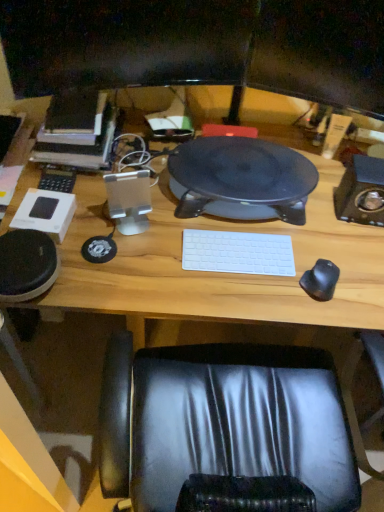
Question: Is matte black monitor at upper center, marked as the 2th computer monitor in a left-to-right arrangement, outside of black rubber mouse at right?

Choices:
 (A) no
 (B) yes

Answer: (B)

Question: Does matte black monitor at upper center, which ranks as the first computer monitor in right-to-left order, have a larger size compared to black rubber mouse at right?

Choices:
 (A) yes
 (B) no

Answer: (A)

Question: Is matte black monitor at upper center, which ranks as the first computer monitor in right-to-left order, at the right side of black rubber mouse at right?

Choices:
 (A) no
 (B) yes

Answer: (B)

Question: From a real-world perspective, is matte black monitor at upper center, marked as the 2th computer monitor in a left-to-right arrangement, located higher than black rubber mouse at right?

Choices:
 (A) no
 (B) yes

Answer: (B)

Question: Is the position of matte black monitor at upper center, which ranks as the first computer monitor in right-to-left order, more distant than that of black rubber mouse at right?

Choices:
 (A) no
 (B) yes

Answer: (A)

Question: Is hardcover book at left facing away from matte black monitor at upper center, which ranks as the first computer monitor in right-to-left order?

Choices:
 (A) yes
 (B) no

Answer: (B)

Question: Considering the relative sizes of hardcover book at left and matte black monitor at upper center, which ranks as the first computer monitor in right-to-left order, in the image provided, is hardcover book at left wider than matte black monitor at upper center, which ranks as the first computer monitor in right-to-left order,?

Choices:
 (A) no
 (B) yes

Answer: (B)

Question: Is hardcover book at left taller than matte black monitor at upper center, which ranks as the first computer monitor in right-to-left order?

Choices:
 (A) yes
 (B) no

Answer: (B)

Question: Does hardcover book at left appear on the right side of matte black monitor at upper center, marked as the 2th computer monitor in a left-to-right arrangement?

Choices:
 (A) no
 (B) yes

Answer: (A)

Question: Does hardcover book at left have a larger size compared to matte black monitor at upper center, which ranks as the first computer monitor in right-to-left order?

Choices:
 (A) no
 (B) yes

Answer: (B)

Question: Does hardcover book at left touch matte black monitor at upper center, which ranks as the first computer monitor in right-to-left order?

Choices:
 (A) yes
 (B) no

Answer: (B)

Question: Considering the relative sizes of black glossy monitor at upper center, acting as the 1th computer monitor starting from the left, and hardcover book at left in the image provided, is black glossy monitor at upper center, acting as the 1th computer monitor starting from the left, shorter than hardcover book at left?

Choices:
 (A) yes
 (B) no

Answer: (B)